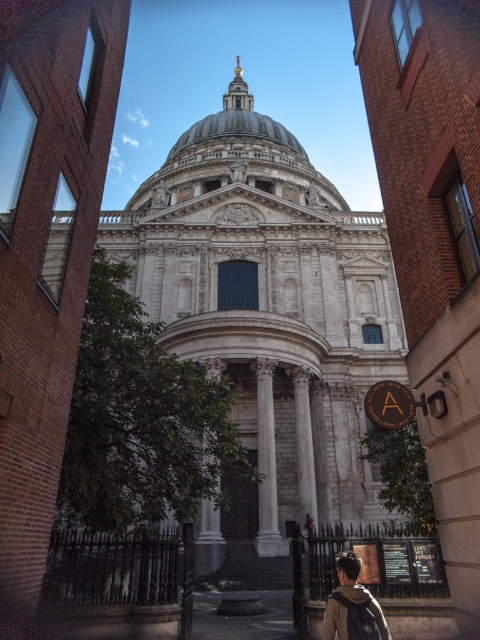
You are a photographer standing at the base of the white marble church at center. You want to take a photo that includes both the church and the dark brown leather backpack at lower right in the frame. Based on their positions, will the backpack appear smaller or larger in the photo compared to the church?

The white marble church at center is above dark brown leather backpack at lower right, so the backpack will appear smaller in the photo compared to the church because it is positioned farther away from the camera.

You are standing at the entrance of the white marble church at center. If you walk straight ahead, will you eventually see the golden cross on top of the dome?

Yes, the white marble church at center is located at point [267,316], which is directly in front of you, so walking straight ahead will lead you towards the dome and its golden cross.